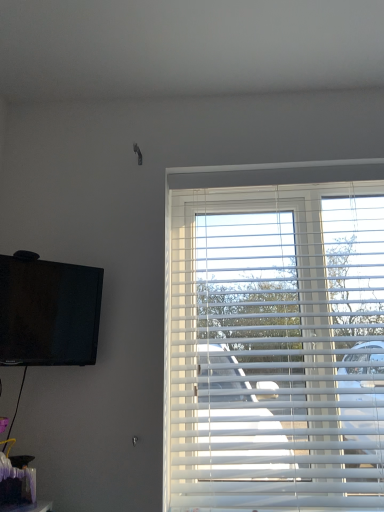
Question: Can you confirm if matte black tv at upper left is bigger than white plastic blinds at right?

Choices:
 (A) no
 (B) yes

Answer: (A)

Question: Is matte black tv at upper left not near white plastic blinds at right?

Choices:
 (A) no
 (B) yes

Answer: (A)

Question: From a real-world perspective, is matte black tv at upper left below white plastic blinds at right?

Choices:
 (A) no
 (B) yes

Answer: (A)

Question: Considering the relative sizes of matte black tv at upper left and white plastic blinds at right in the image provided, is matte black tv at upper left wider than white plastic blinds at right?

Choices:
 (A) no
 (B) yes

Answer: (A)

Question: From the image's perspective, is matte black tv at upper left beneath white plastic blinds at right?

Choices:
 (A) yes
 (B) no

Answer: (B)

Question: Is matte black tv at upper left taller than white plastic blinds at right?

Choices:
 (A) yes
 (B) no

Answer: (B)

Question: Is white plastic blinds at right positioned behind matte black tv at upper left?

Choices:
 (A) yes
 (B) no

Answer: (A)

Question: Is white plastic blinds at right facing towards matte black tv at upper left?

Choices:
 (A) no
 (B) yes

Answer: (A)

Question: Is white plastic blinds at right closer to camera compared to matte black tv at upper left?

Choices:
 (A) no
 (B) yes

Answer: (A)

Question: From the image's perspective, does white plastic blinds at right appear higher than matte black tv at upper left?

Choices:
 (A) no
 (B) yes

Answer: (A)

Question: Is white plastic blinds at right directly adjacent to matte black tv at upper left?

Choices:
 (A) yes
 (B) no

Answer: (B)

Question: Is white plastic blinds at right not within matte black tv at upper left?

Choices:
 (A) yes
 (B) no

Answer: (A)

Question: Is matte black tv at upper left to the left or to the right of white plastic blinds at right in the image?

Choices:
 (A) right
 (B) left

Answer: (B)